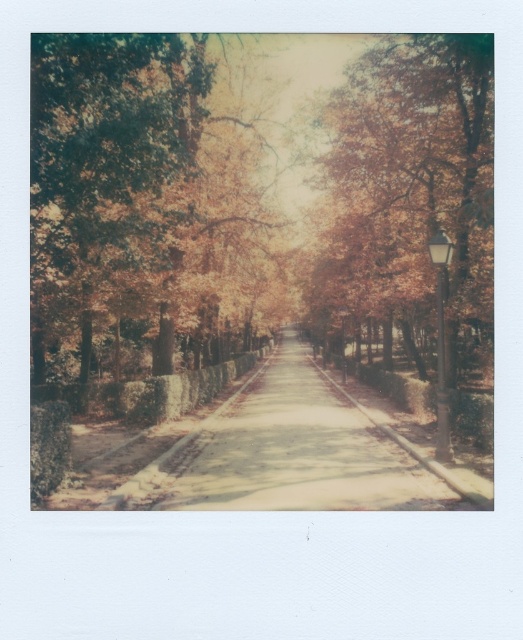
Does green textured tree at left have a smaller size compared to autumn leaves at center?

No.

Does point (31, 317) come in front of point (384, 84)?

Yes.

Image resolution: width=523 pixels, height=640 pixels. In order to click on green textured tree at left in this screenshot , I will do `click(138, 196)`.